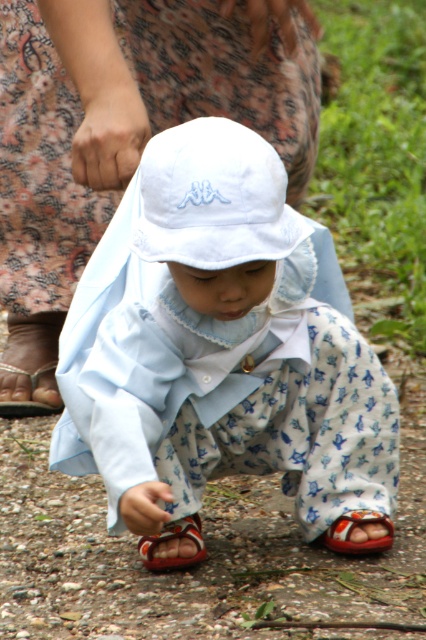
Question: Among these objects, which one is farthest from the camera?

Choices:
 (A) floral dress at upper center
 (B) reddish-brown fabric sandal at lower center
 (C) white fabric hat at center
 (D) brown leather sandal at lower left

Answer: (D)

Question: Based on their relative distances, which object is farther from the reddish-brown fabric sandal at lower center?

Choices:
 (A) white cotton hat at center
 (B) white fabric hat at center
 (C) floral dress at upper center
 (D) brown leather sandal at lower left

Answer: (C)

Question: Is white fabric hat at center thinner than reddish-brown fabric sandal at lower center?

Choices:
 (A) yes
 (B) no

Answer: (B)

Question: Can you confirm if floral dress at upper center is thinner than white fabric hat at center?

Choices:
 (A) no
 (B) yes

Answer: (A)

Question: Is white fabric hat at center wider than brown leather sandal at lower left?

Choices:
 (A) no
 (B) yes

Answer: (B)

Question: Which object appears closest to the camera in this image?

Choices:
 (A) red leather sandal at lower right
 (B) brown leather sandal at lower left
 (C) white cotton hat at center

Answer: (C)